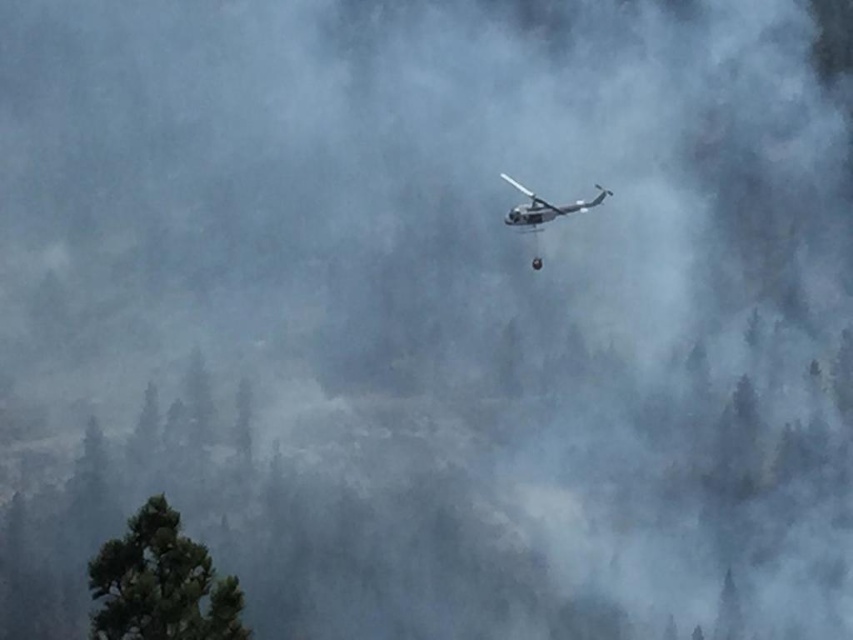
Question: Is green textured tree at lower left below metallic gray helicopter at center?

Choices:
 (A) no
 (B) yes

Answer: (B)

Question: Among these objects, which one is nearest to the camera?

Choices:
 (A) green textured tree at lower left
 (B) metallic gray helicopter at center

Answer: (A)

Question: Can you confirm if green textured tree at lower left is thinner than metallic gray helicopter at center?

Choices:
 (A) no
 (B) yes

Answer: (B)

Question: Which object appears closest to the camera in this image?

Choices:
 (A) metallic gray helicopter at center
 (B) green textured tree at lower left

Answer: (B)

Question: Among these objects, which one is farthest from the camera?

Choices:
 (A) green textured tree at lower left
 (B) metallic gray helicopter at center

Answer: (B)

Question: Considering the relative positions of green textured tree at lower left and metallic gray helicopter at center in the image provided, where is green textured tree at lower left located with respect to metallic gray helicopter at center?

Choices:
 (A) left
 (B) right

Answer: (A)